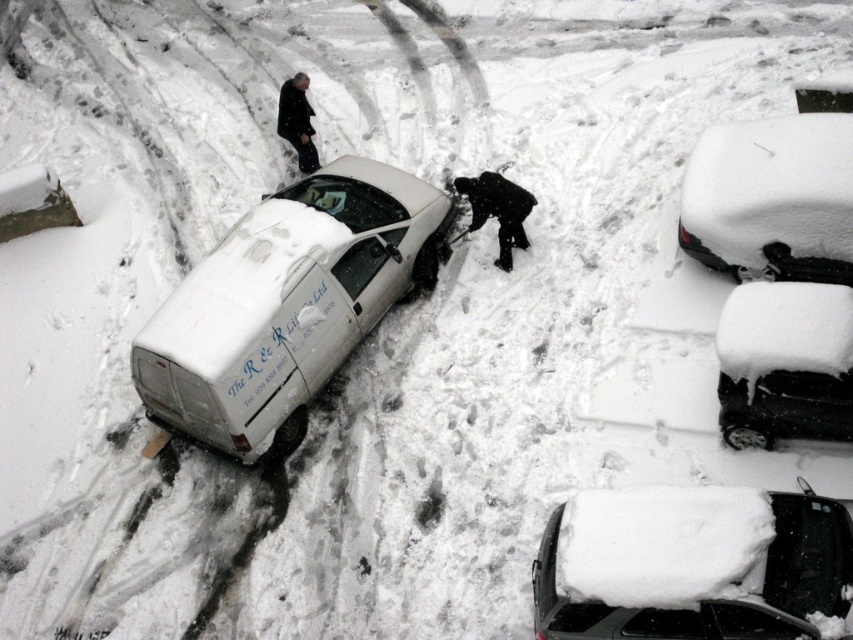
You are a snow removal expert trying to free the white matte van at center from the snow. There is a black matte jacket at center right nearby. Which object is closer to the left edge of the image?

The white matte van at center is closer to the left edge of the image because it is positioned on the left side of the black matte jacket at center right.

You are a driver trying to park your car in the parking lot shown in the image. You see the white matte van at center and the white matte car at upper right. Which vehicle should you avoid parking too close to if you want to ensure enough space for your car to exit easily?

The white matte van at center is taller than the white matte car at upper right, so you should avoid parking too close to the white matte van at center because it is taller and may require more space to exit safely.

You are standing at the point marked as point [254,216]. You need to move towards the white van. Is the van closer to you or farther away than 10 meters?

The point [254,216] is 10.92 meters from the viewer. Since the van is in the snow scene, it is likely positioned further away from the point, so the van is farther away than 10 meters.